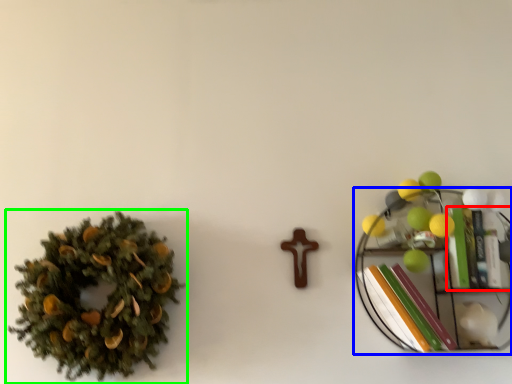
Question: Based on their relative distances, which object is farther from book (highlighted by a red box)? Choose from shelf (highlighted by a blue box) and houseplant (highlighted by a green box).

Choices:
 (A) shelf
 (B) houseplant

Answer: (B)